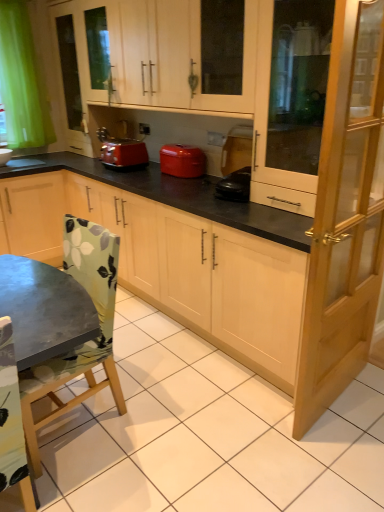
Question: Does matte wood cabinet at upper center, the first cabinetry from the top, lie behind transparent glass cabinet at right, the 1th screen door when ordered from top to bottom?

Choices:
 (A) yes
 (B) no

Answer: (A)

Question: Is matte wood cabinet at upper center, the first cabinetry from the top, closer to the viewer compared to transparent glass cabinet at right, which is counted as the 2th screen door, starting from the bottom?

Choices:
 (A) no
 (B) yes

Answer: (A)

Question: Can you confirm if matte wood cabinet at upper center, the first cabinetry from the top, is bigger than transparent glass cabinet at right, which is counted as the 2th screen door, starting from the bottom?

Choices:
 (A) no
 (B) yes

Answer: (B)

Question: Is matte wood cabinet at upper center, the first cabinetry from the top, oriented away from transparent glass cabinet at right, which is counted as the 2th screen door, starting from the bottom?

Choices:
 (A) yes
 (B) no

Answer: (B)

Question: Does matte wood cabinet at upper center, the first cabinetry from the top, have a greater width compared to transparent glass cabinet at right, which is counted as the 2th screen door, starting from the bottom?

Choices:
 (A) no
 (B) yes

Answer: (B)

Question: Relative to matte red toaster at center, is light brown wooden screen door at right, positioned as the first screen door in bottom-to-top order, in front or behind?

Choices:
 (A) behind
 (B) front

Answer: (B)

Question: Considering the positions of point (367, 137) and point (183, 167), is point (367, 137) closer or farther from the camera than point (183, 167)?

Choices:
 (A) farther
 (B) closer

Answer: (B)

Question: Considering the positions of light brown wooden screen door at right, positioned as the first screen door in bottom-to-top order, and matte red toaster at center in the image, is light brown wooden screen door at right, positioned as the first screen door in bottom-to-top order, bigger or smaller than matte red toaster at center?

Choices:
 (A) big
 (B) small

Answer: (A)

Question: From a real-world perspective, is light brown wooden screen door at right, which is counted as the second screen door, starting from the top, positioned above or below matte red toaster at center?

Choices:
 (A) below
 (B) above

Answer: (A)

Question: Is light brown wooden screen door at right, positioned as the first screen door in bottom-to-top order, in front of or behind matte wood cabinet at upper center, which ranks as the 2th cabinetry in bottom-to-top order, in the image?

Choices:
 (A) behind
 (B) front

Answer: (B)

Question: From the image's perspective, is light brown wooden screen door at right, which is counted as the second screen door, starting from the top, located above or below matte wood cabinet at upper center, the first cabinetry from the top?

Choices:
 (A) above
 (B) below

Answer: (B)

Question: Is light brown wooden screen door at right, which is counted as the second screen door, starting from the top, inside or outside of matte wood cabinet at upper center, the first cabinetry from the top?

Choices:
 (A) outside
 (B) inside

Answer: (A)

Question: Considering the positions of light brown wooden screen door at right, positioned as the first screen door in bottom-to-top order, and matte wood cabinet at upper center, which ranks as the 2th cabinetry in bottom-to-top order, in the image, is light brown wooden screen door at right, positioned as the first screen door in bottom-to-top order, wider or thinner than matte wood cabinet at upper center, which ranks as the 2th cabinetry in bottom-to-top order,?

Choices:
 (A) wide
 (B) thin

Answer: (B)

Question: Is light brown wooden screen door at right, which is counted as the second screen door, starting from the top, taller or shorter than green fabric chair at lower left?

Choices:
 (A) tall
 (B) short

Answer: (A)

Question: Do you think light brown wooden screen door at right, positioned as the first screen door in bottom-to-top order, is within green fabric chair at lower left, or outside of it?

Choices:
 (A) outside
 (B) inside

Answer: (A)